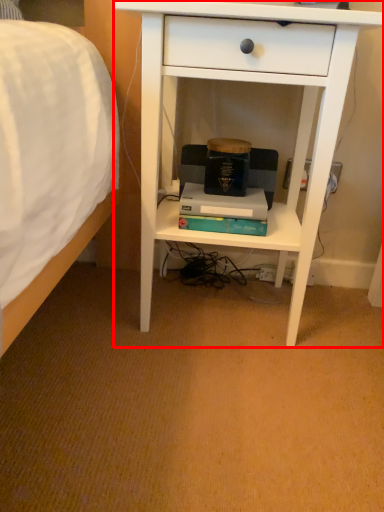
Question: From the image's perspective, considering the relative positions of desk (annotated by the red box) and paperback book in the image provided, where is desk (annotated by the red box) located with respect to the staircase?

Choices:
 (A) above
 (B) below

Answer: (A)